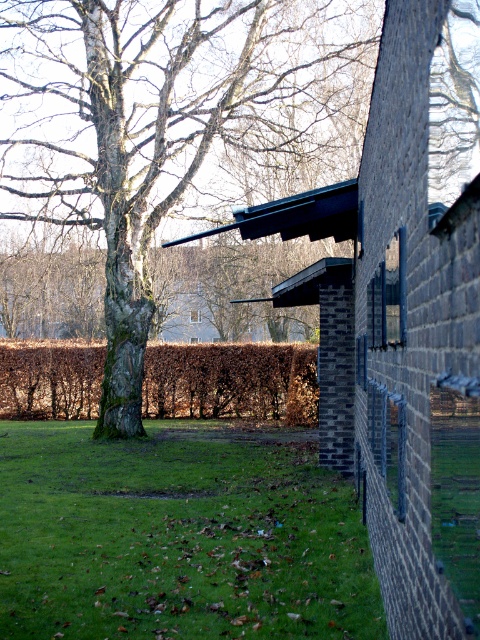
Question: Which point is farther to the camera?

Choices:
 (A) green grass at lower center
 (B) brown leafy hedge at center
 (C) smooth bark tree at center

Answer: (B)

Question: Can you confirm if smooth bark tree at center is smaller than green grass at lower center?

Choices:
 (A) no
 (B) yes

Answer: (A)

Question: Can you confirm if smooth bark tree at center is positioned to the right of brown leafy hedge at center?

Choices:
 (A) no
 (B) yes

Answer: (B)

Question: Which object appears farthest from the camera in this image?

Choices:
 (A) green grass at lower center
 (B) smooth bark tree at center

Answer: (B)

Question: Which object is farther from the camera taking this photo?

Choices:
 (A) smooth bark tree at center
 (B) green grass at lower center
 (C) brown leafy hedge at center

Answer: (C)

Question: Does smooth bark tree at center lie in front of green grass at lower center?

Choices:
 (A) yes
 (B) no

Answer: (B)